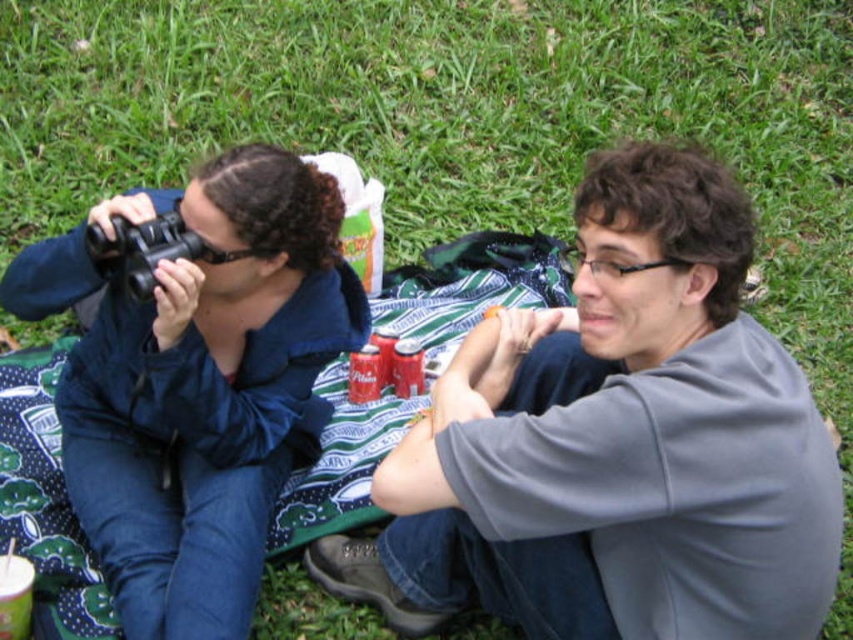
Question: Which of the following is the closest to the observer?

Choices:
 (A) (177, 472)
 (B) (90, 253)

Answer: (B)

Question: Can you confirm if matte black binoculars at left is positioned above black plastic binoculars at upper left?

Choices:
 (A) yes
 (B) no

Answer: (B)

Question: Does matte black binoculars at left have a larger size compared to black plastic binoculars at upper left?

Choices:
 (A) no
 (B) yes

Answer: (B)

Question: Is matte black binoculars at left further to the viewer compared to black plastic binoculars at upper left?

Choices:
 (A) no
 (B) yes

Answer: (B)

Question: Which point is farther to the camera?

Choices:
 (A) black plastic binoculars at upper left
 (B) matte black binoculars at left

Answer: (B)